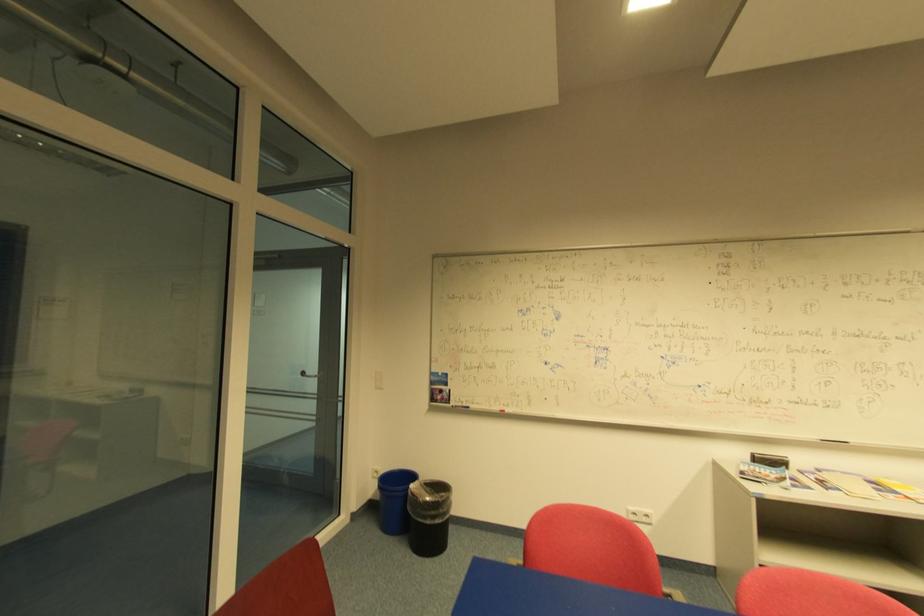
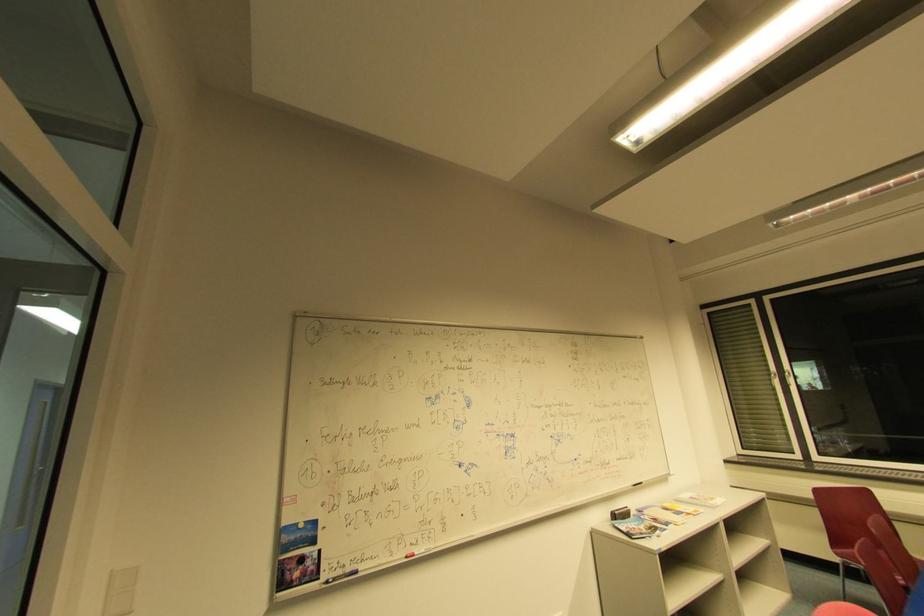
Find the pixel in the second image that matches point (881, 490) in the first image.

(679, 515)